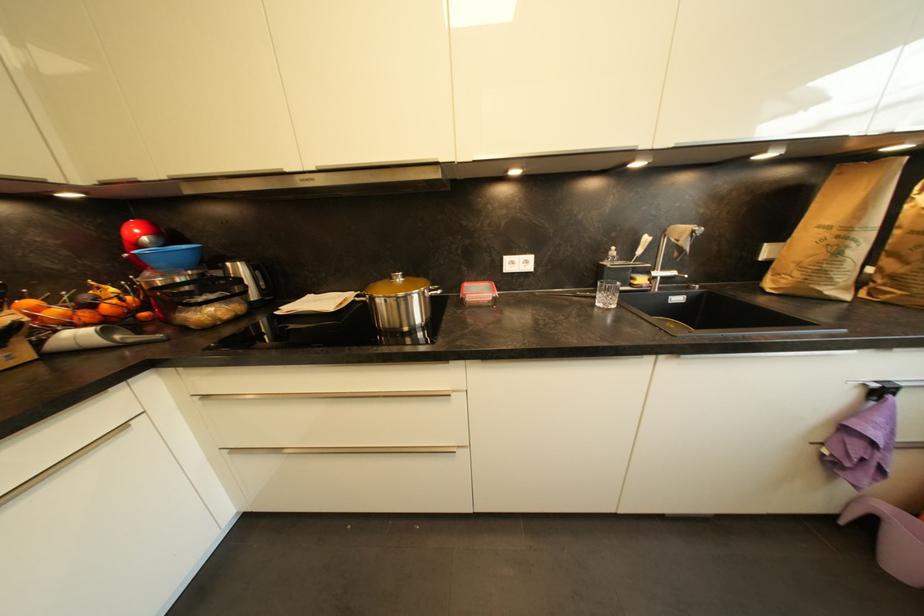
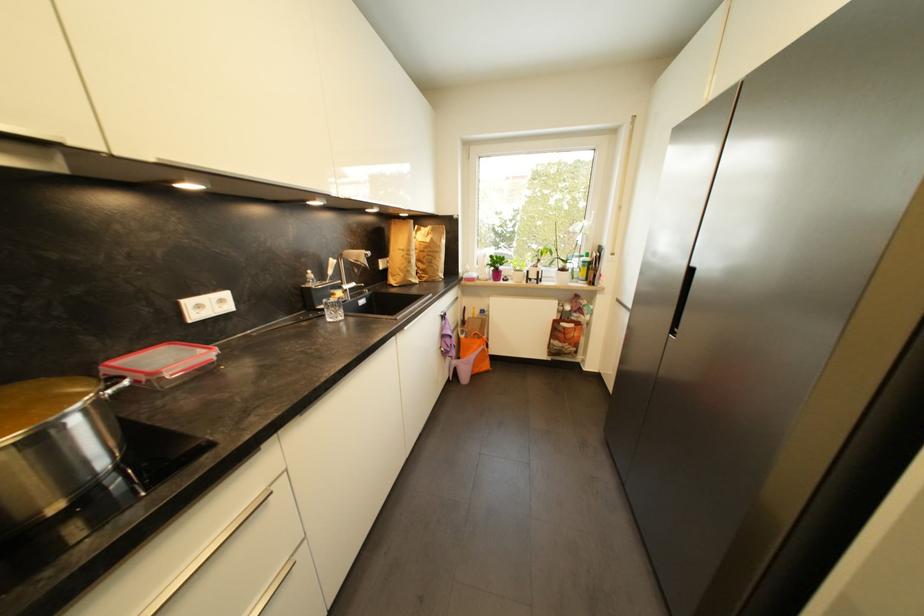
Where in the second image is the point corresponding to the point at 434,294 from the first image?

(114, 394)